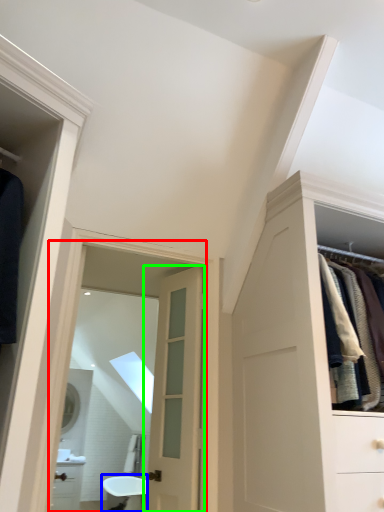
Question: Which is farther away from mirror (highlighted by a red box)? bath (highlighted by a blue box) or door (highlighted by a green box)?

Choices:
 (A) bath
 (B) door

Answer: (A)